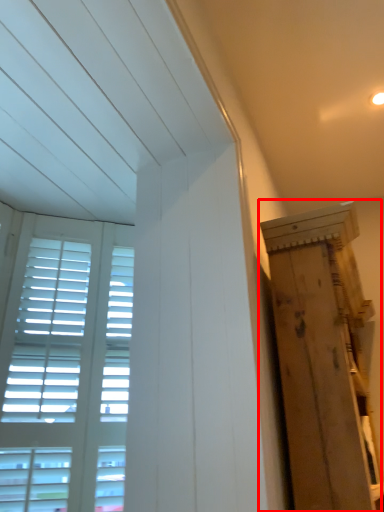
Question: From the image's perspective, where is plywood (annotated by the red box) located relative to window?

Choices:
 (A) below
 (B) above

Answer: (A)